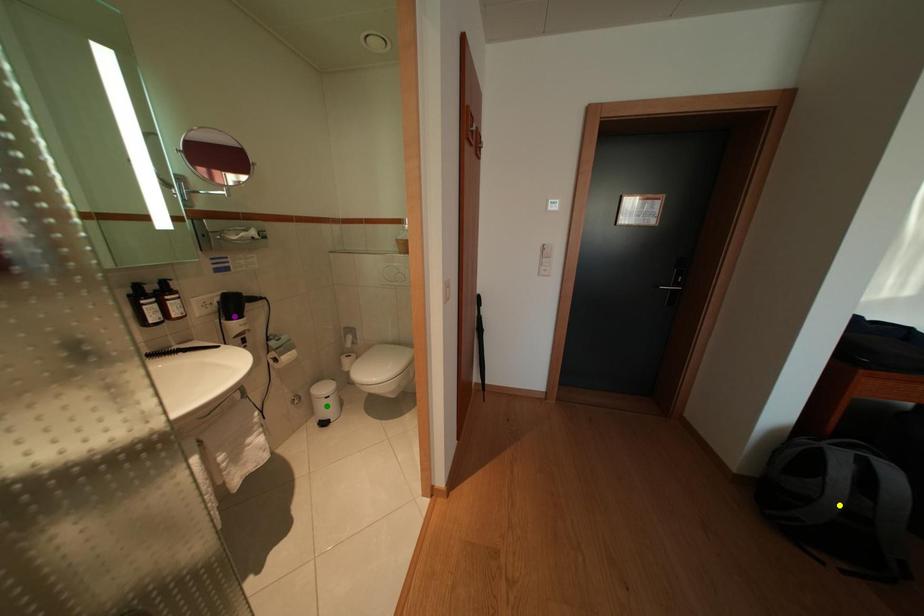
Order these from farthest to nearest:
yellow point, purple point, green point

1. green point
2. purple point
3. yellow point